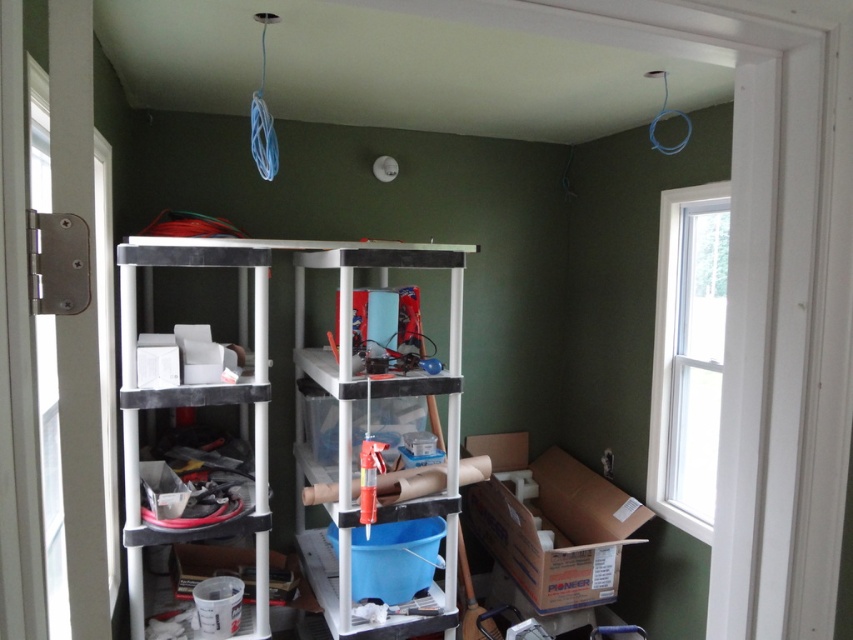
Question: Does cardboard box at lower right appear on the left side of white plastic shelf at center?

Choices:
 (A) yes
 (B) no

Answer: (B)

Question: Which of the following is the farthest from the observer?

Choices:
 (A) cardboard box at lower right
 (B) white plastic shelf at center

Answer: (A)

Question: Is cardboard box at lower right to the left of matte black shelving unit at left from the viewer's perspective?

Choices:
 (A) no
 (B) yes

Answer: (A)

Question: Which of the following is the farthest from the observer?

Choices:
 (A) (453, 561)
 (B) (538, 588)
 (C) (189, 531)

Answer: (B)

Question: Which point is farther from the camera taking this photo?

Choices:
 (A) (498, 563)
 (B) (126, 358)
 (C) (378, 264)

Answer: (A)

Question: Does white plastic shelf at center appear on the right side of matte black shelving unit at left?

Choices:
 (A) yes
 (B) no

Answer: (A)